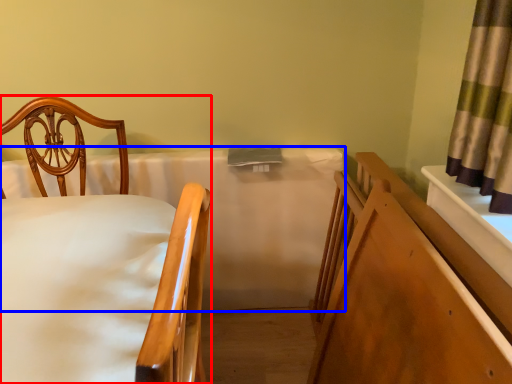
Question: Which object is closer to the camera taking this photo, chair (highlighted by a red box) or mattress (highlighted by a blue box)?

Choices:
 (A) chair
 (B) mattress

Answer: (A)